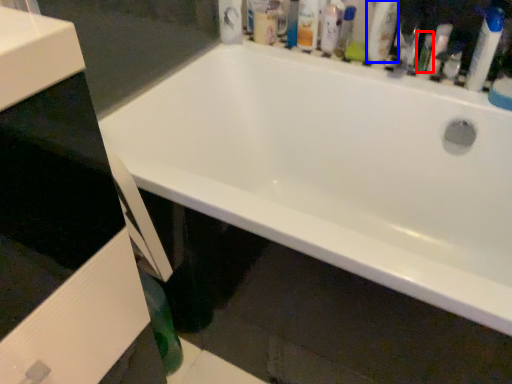
Question: Which object is closer to the camera taking this photo, toiletry (highlighted by a red box) or cleaning product (highlighted by a blue box)?

Choices:
 (A) toiletry
 (B) cleaning product

Answer: (B)